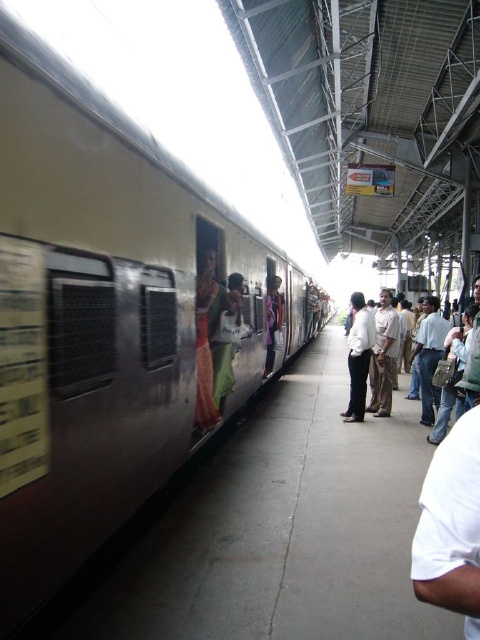
From the picture: Which of these two, light brown cotton shirt at center or light brown leather backpack at right, stands taller?

With more height is light brown leather backpack at right.

In order to click on light brown cotton shirt at center in this screenshot , I will do `click(384, 356)`.

The image size is (480, 640). Identify the location of light brown cotton shirt at center. (384, 356).

Is metallic silver train at center wider than light brown cotton shirt at center?

No.

Between metallic silver train at center and light brown cotton shirt at center, which one is positioned higher?

light brown cotton shirt at center is above.

Does point (199, 339) come closer to viewer compared to point (391, 400)?

Yes, it is.

Identify the location of metallic silver train at center. This screenshot has width=480, height=640. (108, 317).

Is metallic silver train at center bigger than light brown leather backpack at right?

Actually, metallic silver train at center might be smaller than light brown leather backpack at right.

Is metallic silver train at center below light brown leather backpack at right?

Indeed, metallic silver train at center is positioned under light brown leather backpack at right.

Describe the element at coordinates (108, 317) in the screenshot. I see `metallic silver train at center` at that location.

You are a GUI agent. You are given a task and a screenshot of the screen. Output one action in this format:
    pyautogui.click(x=<x>, y=<y>)
    Task: Click on the metallic silver train at center
    
    Given the screenshot: What is the action you would take?
    pyautogui.click(x=108, y=317)